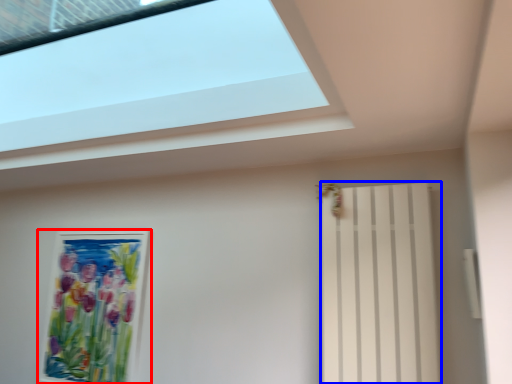
Question: Which object appears closest to the camera in this image, picture frame (highlighted by a red box) or shutter (highlighted by a blue box)?

Choices:
 (A) picture frame
 (B) shutter

Answer: (B)